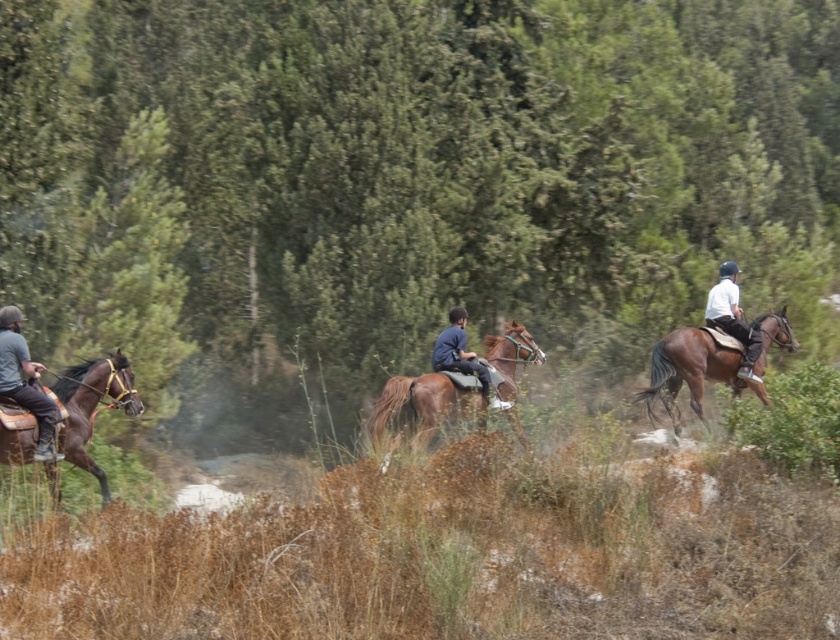
Question: Among these objects, which one is nearest to the camera?

Choices:
 (A) green leafy tree at center
 (B) dark gray fabric jacket at left

Answer: (B)

Question: Estimate the real-world distances between objects in this image. Which object is closer to the brown glossy horse at left?

Choices:
 (A) dark gray fabric jacket at left
 (B) brown glossy horse at center
 (C) green leafy tree at center
 (D) brown glossy horse at right

Answer: (A)

Question: Does brown glossy horse at center have a greater width compared to brown glossy horse at left?

Choices:
 (A) no
 (B) yes

Answer: (B)

Question: Which object is farther from the camera taking this photo?

Choices:
 (A) white matte shirt at right
 (B) dark blue fabric jacket at center
 (C) brown glossy horse at right

Answer: (A)

Question: Is brown glossy horse at right positioned before white matte shirt at right?

Choices:
 (A) yes
 (B) no

Answer: (A)

Question: Is brown glossy horse at right further to the viewer compared to white matte shirt at right?

Choices:
 (A) no
 (B) yes

Answer: (A)